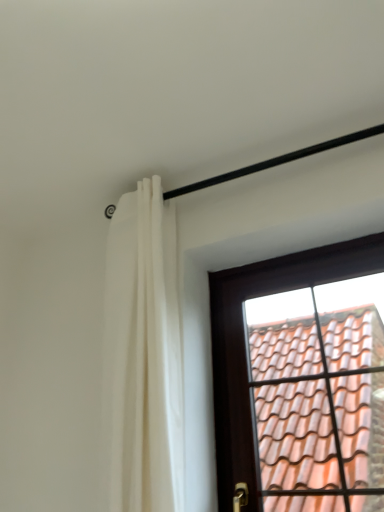
Where is `brown wooden window at upper right`? The width and height of the screenshot is (384, 512). brown wooden window at upper right is located at coordinates (245, 344).

Describe the element at coordinates (245, 344) in the screenshot. Image resolution: width=384 pixels, height=512 pixels. I see `brown wooden window at upper right` at that location.

Describe the element at coordinates (144, 354) in the screenshot. I see `white fabric curtain at upper left` at that location.

Measure the distance between point (140, 198) and camera.

The distance of point (140, 198) from camera is 4.96 feet.

At what (x,y) coordinates should I click in order to perform the action: click on white fabric curtain at upper left. Please return your answer as a coordinate pair (x, y). This screenshot has height=512, width=384. Looking at the image, I should click on (144, 354).

Measure the distance between white fabric curtain at upper left and camera.

white fabric curtain at upper left is 3.53 feet from camera.

The height and width of the screenshot is (512, 384). I want to click on brown wooden window at upper right, so click(x=245, y=344).

Considering the relative positions of brown wooden window at upper right and white fabric curtain at upper left in the image provided, is brown wooden window at upper right to the left of white fabric curtain at upper left from the viewer's perspective?

No.

Considering the positions of objects brown wooden window at upper right and white fabric curtain at upper left in the image provided, who is behind, brown wooden window at upper right or white fabric curtain at upper left?

brown wooden window at upper right is more distant.

Does point (307, 257) lie behind point (151, 306)?

Yes, it is.

From the image's perspective, is brown wooden window at upper right positioned above or below white fabric curtain at upper left?

Based on their image positions, brown wooden window at upper right is located beneath white fabric curtain at upper left.

From a real-world perspective, is brown wooden window at upper right on top of white fabric curtain at upper left?

Incorrect, from a real-world perspective, brown wooden window at upper right is lower than white fabric curtain at upper left.

Does brown wooden window at upper right have a lesser width compared to white fabric curtain at upper left?

Correct, the width of brown wooden window at upper right is less than that of white fabric curtain at upper left.

Is brown wooden window at upper right shorter than white fabric curtain at upper left?

Correct, brown wooden window at upper right is not as tall as white fabric curtain at upper left.

Considering the sizes of objects brown wooden window at upper right and white fabric curtain at upper left in the image provided, who is bigger, brown wooden window at upper right or white fabric curtain at upper left?

white fabric curtain at upper left is bigger.

Is brown wooden window at upper right spatially inside white fabric curtain at upper left, or outside of it?

The correct answer is: outside.

Is brown wooden window at upper right next to white fabric curtain at upper left and touching it?

No, brown wooden window at upper right is not with white fabric curtain at upper left.

Is brown wooden window at upper right looking in the opposite direction of white fabric curtain at upper left?

No.

Looking at this image, how many degrees apart are the facing directions of brown wooden window at upper right and white fabric curtain at upper left?

2.18 degrees.

At what (x,y) coordinates should I click in order to perform the action: click on window that is on the right side of white fabric curtain at upper left. Please return your answer as a coordinate pair (x, y). The image size is (384, 512). Looking at the image, I should click on (245, 344).

Which object is positioned more to the right, white fabric curtain at upper left or brown wooden window at upper right?

From the viewer's perspective, brown wooden window at upper right appears more on the right side.

Which object is further away from the camera taking this photo, white fabric curtain at upper left or brown wooden window at upper right?

Positioned behind is brown wooden window at upper right.

Considering the positions of point (154, 262) and point (216, 387), is point (154, 262) closer or farther from the camera than point (216, 387)?

Point (154, 262) is closer to the camera than point (216, 387).

From the image's perspective, which one is positioned higher, white fabric curtain at upper left or brown wooden window at upper right?

white fabric curtain at upper left, from the image's perspective.

From a real-world perspective, does white fabric curtain at upper left stand above brown wooden window at upper right?

Yes, from a real-world perspective, white fabric curtain at upper left is on top of brown wooden window at upper right.

Between white fabric curtain at upper left and brown wooden window at upper right, which one has larger width?

white fabric curtain at upper left is wider.

Between white fabric curtain at upper left and brown wooden window at upper right, which one has less height?

brown wooden window at upper right.

Based on their sizes in the image, would you say white fabric curtain at upper left is bigger or smaller than brown wooden window at upper right?

Considering their sizes, white fabric curtain at upper left takes up more space than brown wooden window at upper right.

Can we say white fabric curtain at upper left lies outside brown wooden window at upper right?

That's correct, white fabric curtain at upper left is outside of brown wooden window at upper right.

Are white fabric curtain at upper left and brown wooden window at upper right located far from each other?

No.

Could you tell me if white fabric curtain at upper left is facing brown wooden window at upper right?

No, white fabric curtain at upper left does not turn towards brown wooden window at upper right.

Can you tell me how much white fabric curtain at upper left and brown wooden window at upper right differ in facing direction?

2.18 degrees.

Where is `window located on the right of white fabric curtain at upper left`? window located on the right of white fabric curtain at upper left is located at coordinates (245, 344).

Find the location of a particular element. The width and height of the screenshot is (384, 512). window below the white fabric curtain at upper left (from the image's perspective) is located at coordinates (245, 344).

In order to click on curtain in front of the brown wooden window at upper right in this screenshot , I will do `click(144, 354)`.